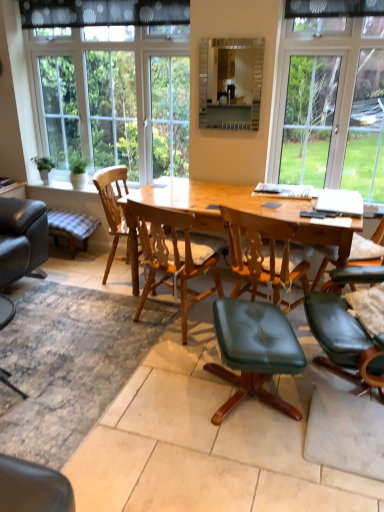
The width and height of the screenshot is (384, 512). In order to click on free area below green leather stool at center, which is counted as the third chair, starting from the back (from a real-world perspective) in this screenshot , I will do `click(247, 399)`.